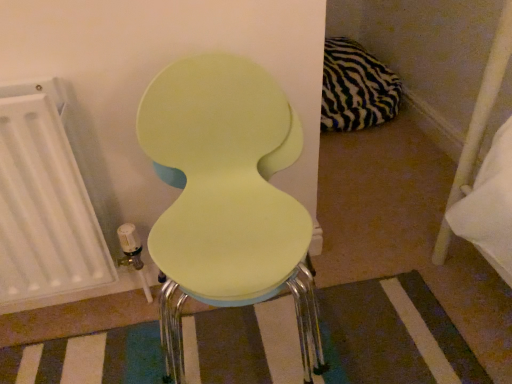
The image size is (512, 384). In order to click on vacant space underneath white matte radiator at left (from a real-world perspective) in this screenshot , I will do `click(77, 312)`.